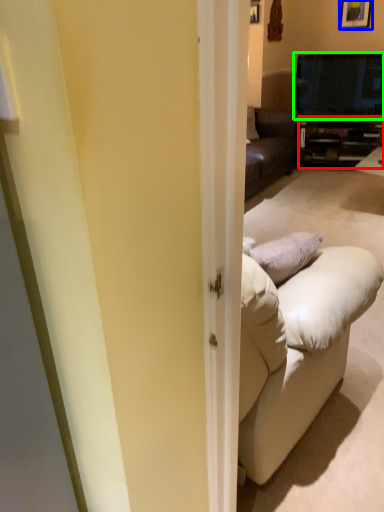
Question: Estimate the real-world distances between objects in this image. Which object is farther from cabinetry (highlighted by a red box), picture frame (highlighted by a blue box) or television (highlighted by a green box)?

Choices:
 (A) picture frame
 (B) television

Answer: (A)